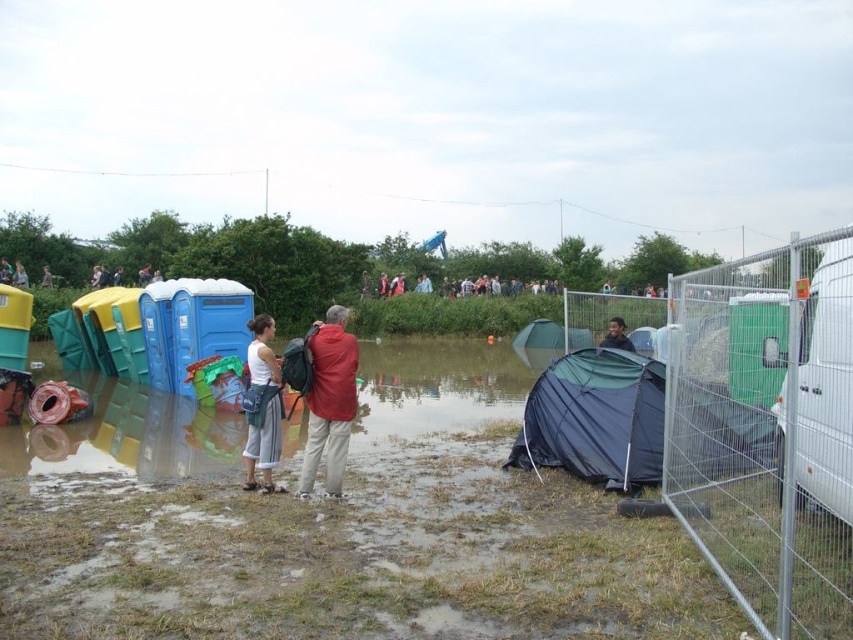
Question: Is galvanized metal fence at right in front of red matte jacket at center?

Choices:
 (A) yes
 (B) no

Answer: (A)

Question: Is white fabric pants at center bigger than white fabric tent at center?

Choices:
 (A) yes
 (B) no

Answer: (B)

Question: Which object is the closest to the dark brown hair at center?

Choices:
 (A) dark gray jacket at center
 (B) white fabric pants at center

Answer: (B)

Question: Does dark blue tarp at lower right come in front of red matte jacket at center?

Choices:
 (A) no
 (B) yes

Answer: (A)

Question: Among these points, which one is nearest to the camera?

Choices:
 (A) (270, 396)
 (B) (45, 272)
 (C) (518, 291)
 (D) (341, 416)

Answer: (D)

Question: Which of the following is the farthest from the observer?

Choices:
 (A) (9, 275)
 (B) (357, 371)
 (C) (550, 339)

Answer: (A)